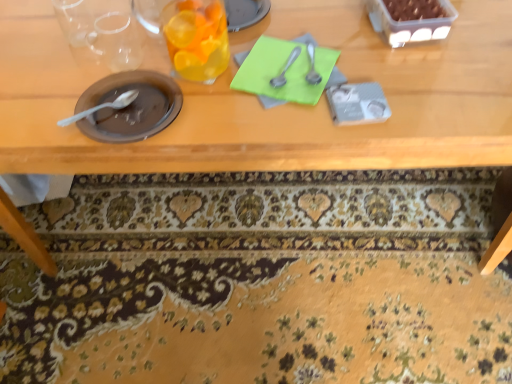
Where is `vacant area that lies in front of translucent glass at upper center, the second tableware when ordered from left to right`? vacant area that lies in front of translucent glass at upper center, the second tableware when ordered from left to right is located at coordinates (219, 119).